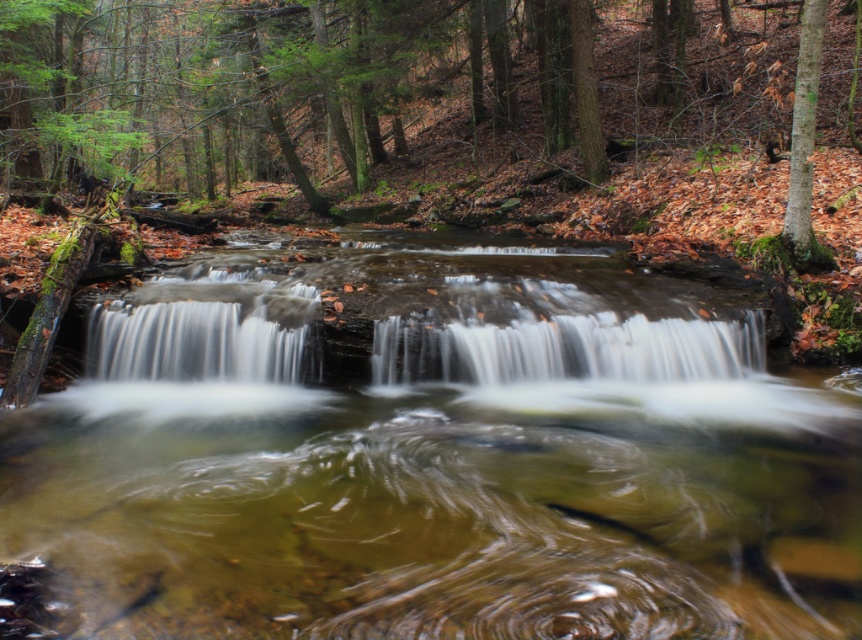
You are standing at the edge of the forest waterfall and notice two types of water features in the scene. Which one is lower in height between the translucent brown water at center and the white frothy water at center?

The translucent brown water at center has a lesser height compared to the white frothy water at center, so the translucent brown water at center is lower in height.

You are standing in the forest scene and want to walk towards the two points marked in the image. Which point, point (640,332) or point (653,376), will you reach first?

Point (640,332) is further to the camera than point (653,376), so you will reach point (653,376) first because it is closer to you.